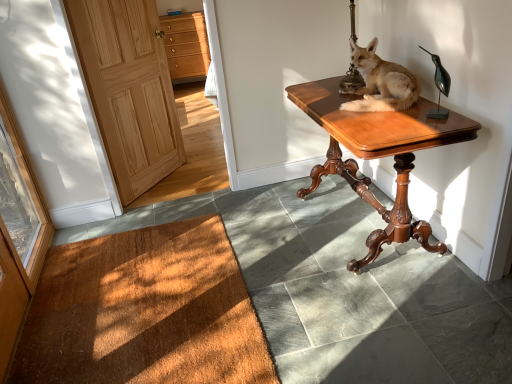
At what (x,y) coordinates should I click in order to perform the action: click on vacant area on the back side of bronze metallic bird at upper right. Please return your answer as a coordinate pair (x, y). Looking at the image, I should click on (415, 108).